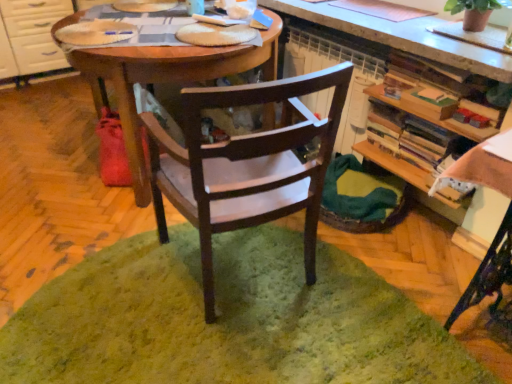
Question: Is white glossy cabinet at left spatially inside wooden bookshelf at right, or outside of it?

Choices:
 (A) outside
 (B) inside

Answer: (A)

Question: Is point (6, 48) positioned closer to the camera than point (391, 170)?

Choices:
 (A) closer
 (B) farther

Answer: (B)

Question: Considering the real-world distances, which object is farthest from the wooden bookshelf at right?

Choices:
 (A) wooden desk at center
 (B) green fuzzy rug at center
 (C) white glossy cabinet at left
 (D) green matte plant at upper right
 (E) mahogany wood chair at center

Answer: (C)

Question: Which is nearer to the white glossy cabinet at left?

Choices:
 (A) green fuzzy rug at center
 (B) wooden bookshelf at right
 (C) green matte plant at upper right
 (D) wooden desk at center
 (E) mahogany wood chair at center

Answer: (D)